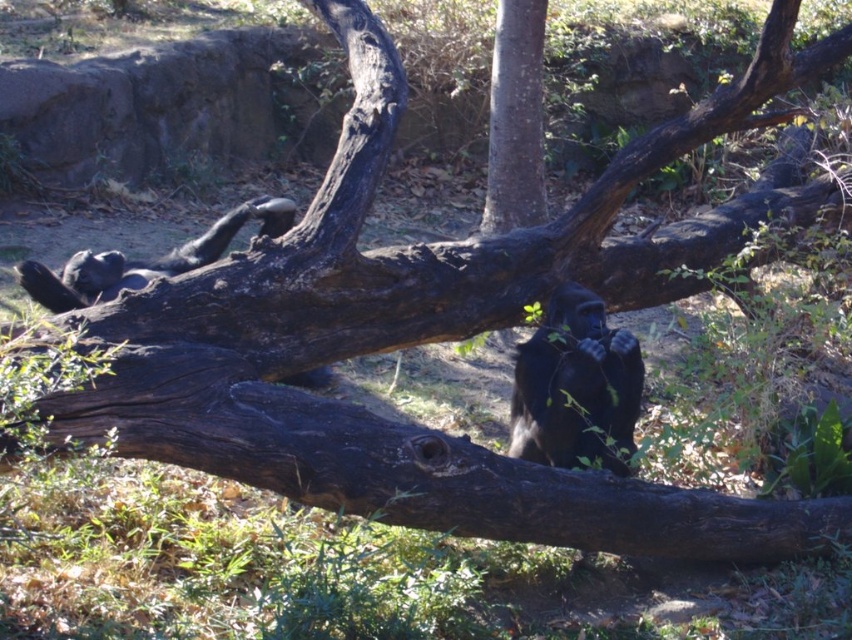
You are a zookeeper who needs to place a feeding tray between the shiny black ape at center and the smooth brown tree trunk at center. The tray requires a minimum of 10 feet of space to be placed safely. Can you fit the tray between them?

The distance between the shiny black ape at center and the smooth brown tree trunk at center is 9.27 feet, which is less than the required 10 feet. Therefore, the feeding tray cannot be placed safely between them.

You are a zookeeper observing the chimpanzees in their enclosure. You notice a shiny black ape at center. Where exactly is this ape positioned in relation to the fallen tree trunk?

The shiny black ape at center is located at point (x=574, y=387), which is on the fallen tree trunk since the trunk is in the foreground and the ape is at center.

You are a zookeeper standing at point (590, 353). You need to throw a banana to the chimpanzee that is closest to you. Which chimpanzee is closer?

The chimpanzee lying on its back atop the fallen trunk is closer to you than the one sitting in the background. Therefore, you should throw the banana to the chimpanzee lying on its back atop the fallen trunk.